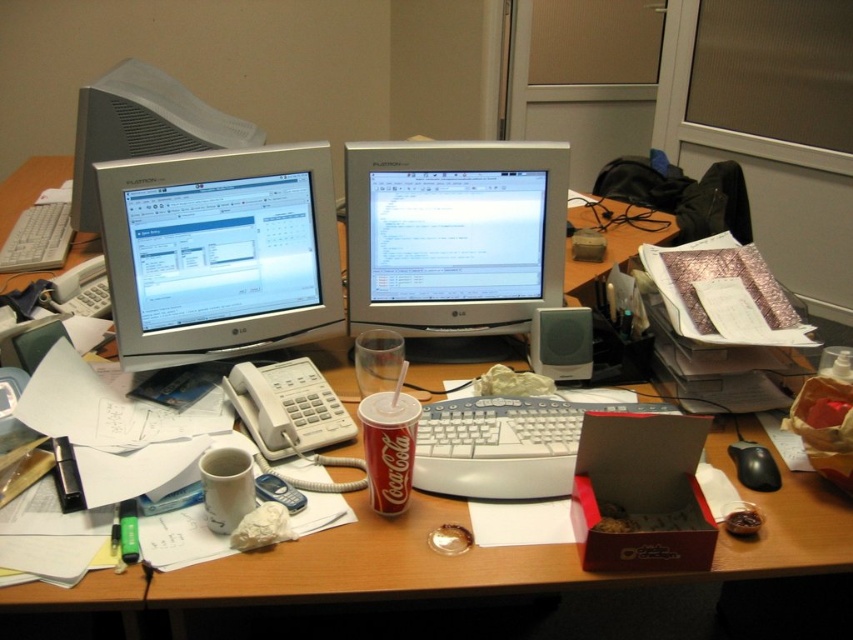
Question: Based on their relative distances, which object is farther from the black plastic mouse at lower right?

Choices:
 (A) coca-cola can at center
 (B) satin silver monitor at center
 (C) matte silver monitor at center left

Answer: (C)

Question: Which of the following is the closest to the observer?

Choices:
 (A) satin silver monitor at center
 (B) white plastic computer desk at center
 (C) matte silver monitor at center left
 (D) coca-cola can at center

Answer: (B)

Question: Is coca-cola can at center wider than black plastic mouse at lower right?

Choices:
 (A) yes
 (B) no

Answer: (A)

Question: Is matte silver monitor at center left to the right of matte silver monitor at upper left from the viewer's perspective?

Choices:
 (A) no
 (B) yes

Answer: (B)

Question: Does white plastic computer desk at center appear over coca-cola can at center?

Choices:
 (A) yes
 (B) no

Answer: (B)

Question: Which of these objects is positioned closest to the black plastic mouse at lower right?

Choices:
 (A) matte silver monitor at center left
 (B) white plastic computer desk at center

Answer: (B)